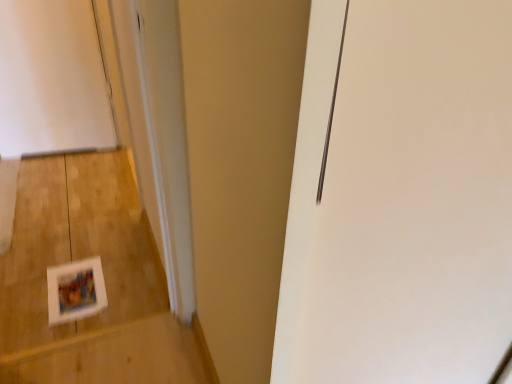
Identify the location of unoccupied region to the right of matte white postcard at lower left. (128, 283).